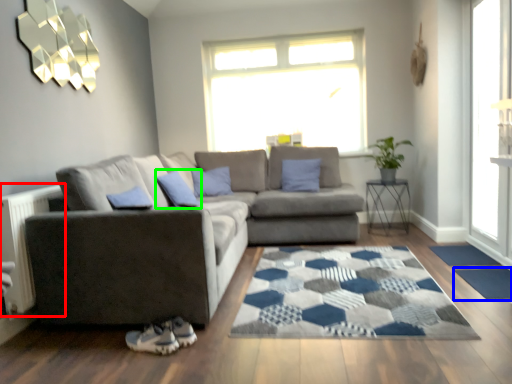
Question: Considering the real-world distances, which object is farthest from radiator (highlighted by a red box)? doormat (highlighted by a blue box) or pillow (highlighted by a green box)?

Choices:
 (A) doormat
 (B) pillow

Answer: (A)